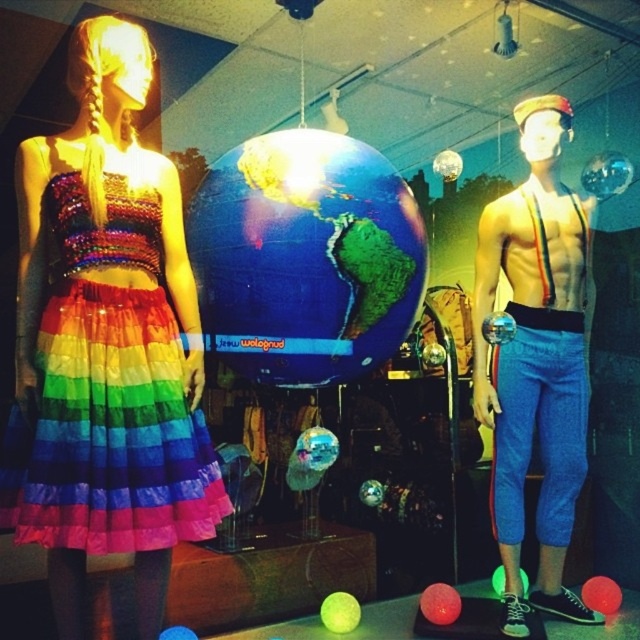
Question: Is glossy plastic globe at center bigger than shiny blue pants at right?

Choices:
 (A) yes
 (B) no

Answer: (B)

Question: Which point is closer to the camera?

Choices:
 (A) shiny blue pants at right
 (B) rainbow tulle skirt at left
 (C) glossy plastic globe at center

Answer: (B)

Question: Which object appears farthest from the camera in this image?

Choices:
 (A) rainbow tulle skirt at left
 (B) shiny blue pants at right

Answer: (B)

Question: Among these objects, which one is nearest to the camera?

Choices:
 (A) glossy plastic globe at center
 (B) shiny blue pants at right
 (C) rainbow tulle skirt at left

Answer: (C)

Question: Is rainbow tulle skirt at left bigger than glossy plastic globe at center?

Choices:
 (A) yes
 (B) no

Answer: (B)

Question: Does glossy plastic globe at center appear on the right side of shiny blue pants at right?

Choices:
 (A) no
 (B) yes

Answer: (A)